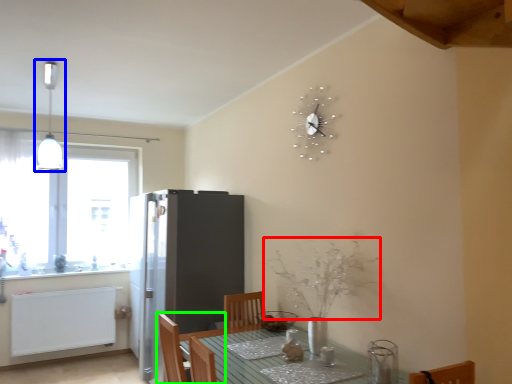
Question: Which object is the farthest from flower (highlighted by a red box)? Choose among these: light fixture (highlighted by a blue box) or chair (highlighted by a green box).

Choices:
 (A) light fixture
 (B) chair

Answer: (A)